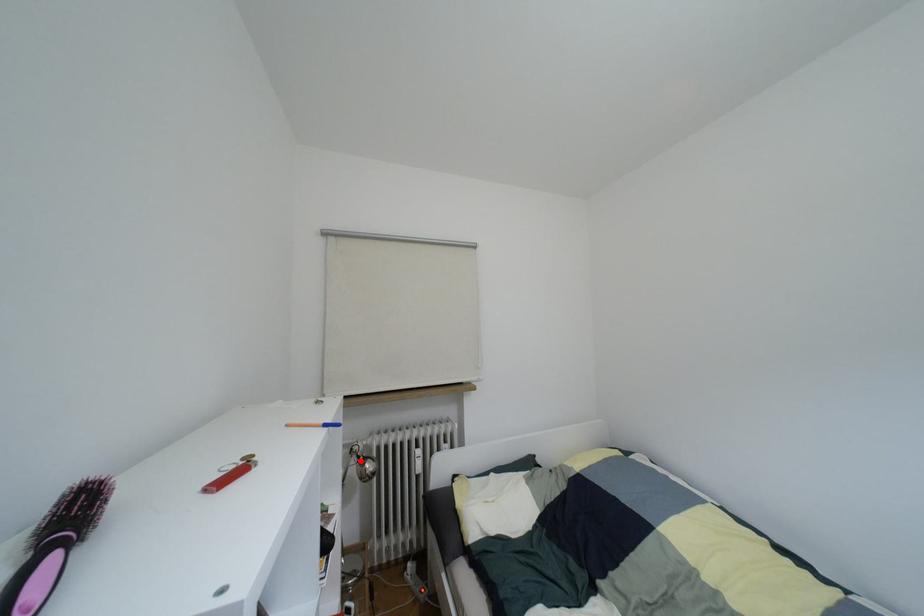
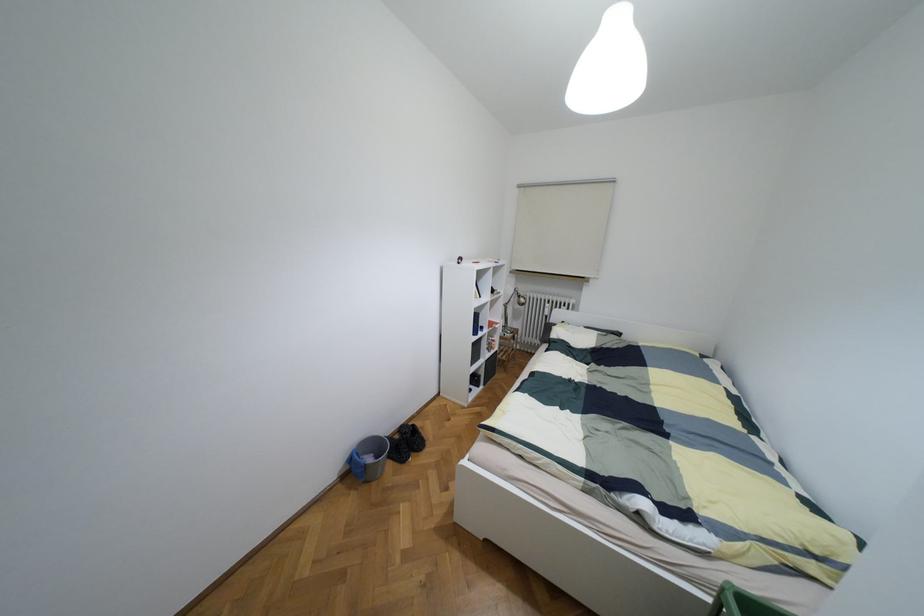
Locate, in the second image, the point that corresponds to the highlighted location in the first image.

(517, 296)